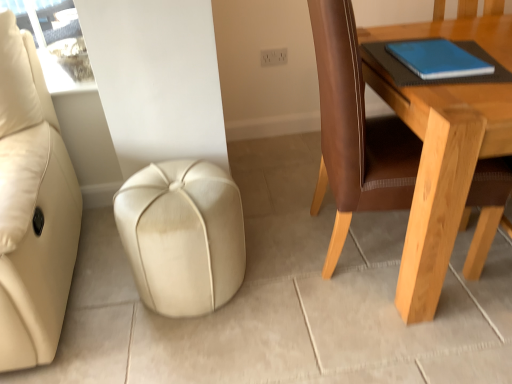
Question: Is blue matte notebook at upper right at the back of beige leather ottoman at center?

Choices:
 (A) no
 (B) yes

Answer: (A)

Question: Is beige leather ottoman at center at the left side of blue matte notebook at upper right?

Choices:
 (A) no
 (B) yes

Answer: (B)

Question: Is the depth of beige leather ottoman at center greater than that of blue matte notebook at upper right?

Choices:
 (A) no
 (B) yes

Answer: (B)

Question: Considering the relative sizes of beige leather ottoman at center and blue matte notebook at upper right in the image provided, is beige leather ottoman at center wider than blue matte notebook at upper right?

Choices:
 (A) yes
 (B) no

Answer: (A)

Question: Does beige leather ottoman at center have a greater height compared to blue matte notebook at upper right?

Choices:
 (A) no
 (B) yes

Answer: (B)

Question: Is blue matte notebook at upper right situated inside beige leather ottoman at center or outside?

Choices:
 (A) inside
 (B) outside

Answer: (B)

Question: From the image's perspective, is blue matte notebook at upper right positioned above or below beige leather ottoman at center?

Choices:
 (A) above
 (B) below

Answer: (A)

Question: Does point (429, 41) appear closer or farther from the camera than point (202, 168)?

Choices:
 (A) closer
 (B) farther

Answer: (B)

Question: In the image, is blue matte notebook at upper right positioned in front of or behind beige leather ottoman at center?

Choices:
 (A) behind
 (B) front

Answer: (B)

Question: In the image, is light brown wooden table at right on the left side or the right side of beige leather ottoman at center?

Choices:
 (A) right
 (B) left

Answer: (A)

Question: Considering the positions of light brown wooden table at right and beige leather ottoman at center in the image, is light brown wooden table at right taller or shorter than beige leather ottoman at center?

Choices:
 (A) tall
 (B) short

Answer: (A)

Question: Is point (336, 125) positioned closer to the camera than point (175, 185)?

Choices:
 (A) farther
 (B) closer

Answer: (B)

Question: Is light brown wooden table at right in front of or behind beige leather ottoman at center in the image?

Choices:
 (A) behind
 (B) front

Answer: (B)

Question: Considering the positions of beige leather ottoman at center and light brown wooden table at right in the image, is beige leather ottoman at center taller or shorter than light brown wooden table at right?

Choices:
 (A) short
 (B) tall

Answer: (A)

Question: From a real-world perspective, is beige leather ottoman at center positioned above or below light brown wooden table at right?

Choices:
 (A) below
 (B) above

Answer: (A)